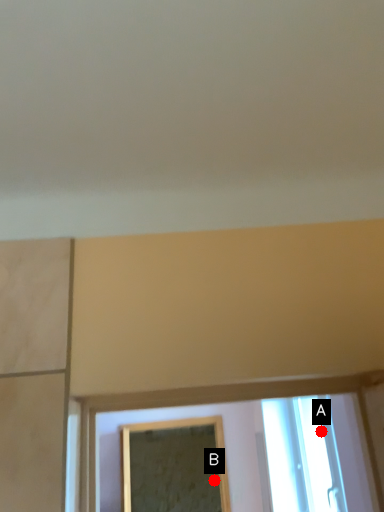
Question: Two points are circled on the image, labeled by A and B beside each circle. Which of the following is the closest to the observer?

Choices:
 (A) A is closer
 (B) B is closer

Answer: (A)